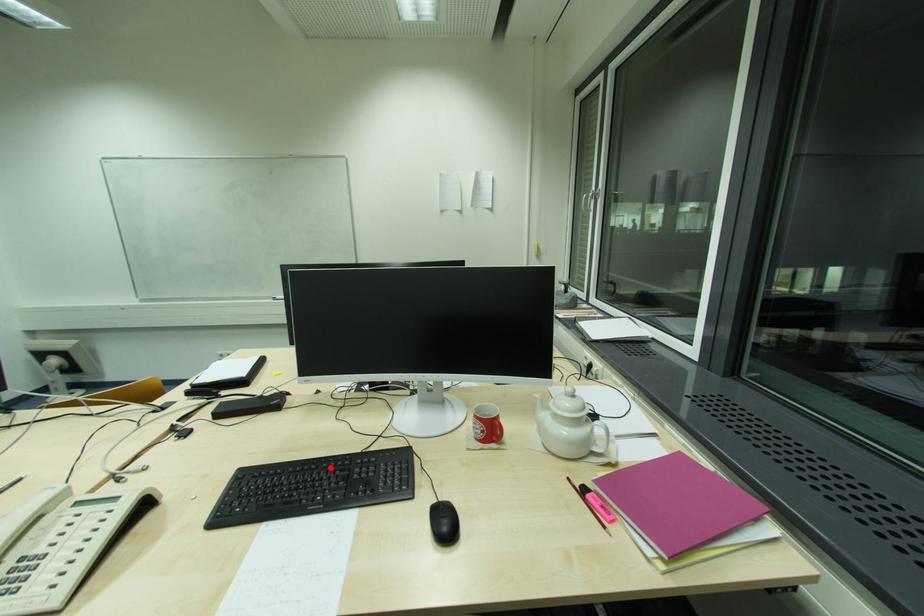
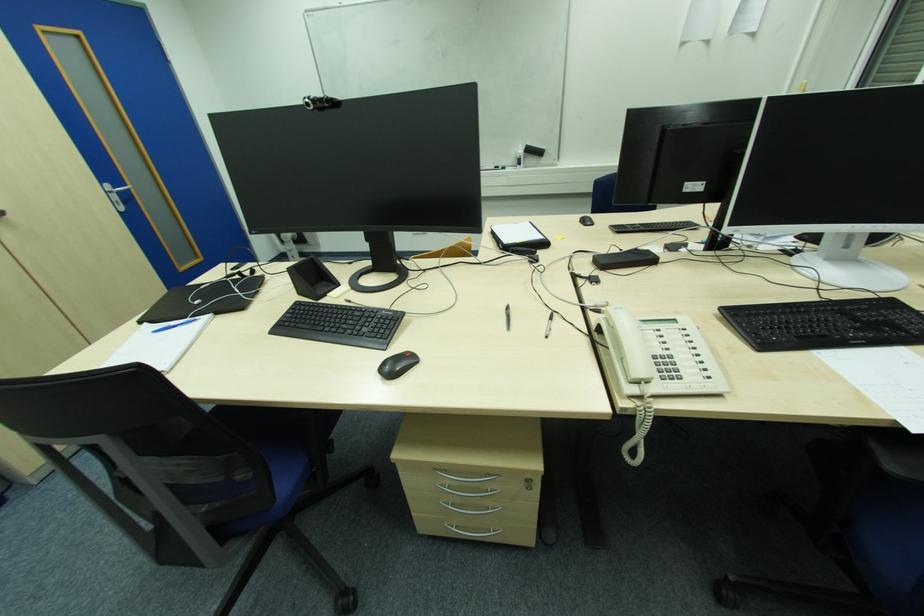
The point at the highlighted location is marked in the first image. Where is the corresponding point in the second image?

(820, 312)